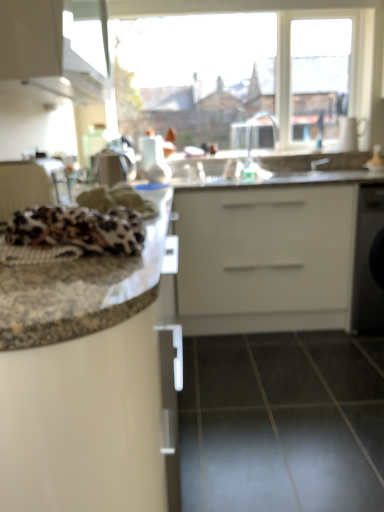
Question: From a real-world perspective, is silver metallic faucet at upper center positioned above or below granite countertop at left?

Choices:
 (A) below
 (B) above

Answer: (B)

Question: From the image's perspective, is silver metallic faucet at upper center above or below granite countertop at left?

Choices:
 (A) below
 (B) above

Answer: (B)

Question: Estimate the real-world distances between objects in this image. Which object is closer to the leopard print fabric at left?

Choices:
 (A) black glossy tile at lower center
 (B) transparent glass window at upper center
 (C) granite countertop at left
 (D) white glossy cabinet at upper left
 (E) silver metallic faucet at upper center

Answer: (C)

Question: Estimate the real-world distances between objects in this image. Which object is closer to the granite countertop at left?

Choices:
 (A) transparent glass window at upper center
 (B) black glossy tile at lower center
 (C) leopard print fabric at left
 (D) white glossy cabinet at upper left
 (E) granite countertop at center

Answer: (C)